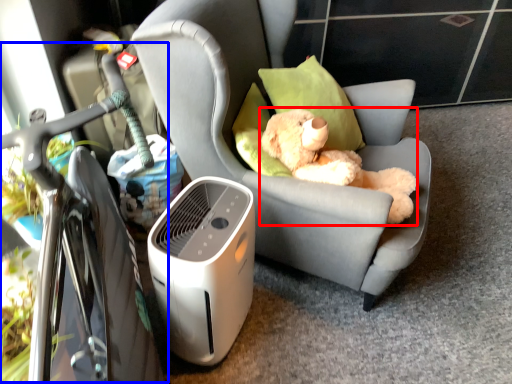
Question: Among these objects, which one is nearest to the camera, toy (highlighted by a red box) or bicycle (highlighted by a blue box)?

Choices:
 (A) toy
 (B) bicycle

Answer: (B)